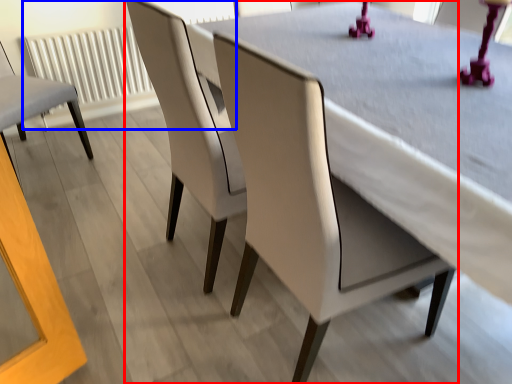
Question: Which object appears closest to the camera in this image, chair (highlighted by a red box) or radiator (highlighted by a blue box)?

Choices:
 (A) chair
 (B) radiator

Answer: (A)